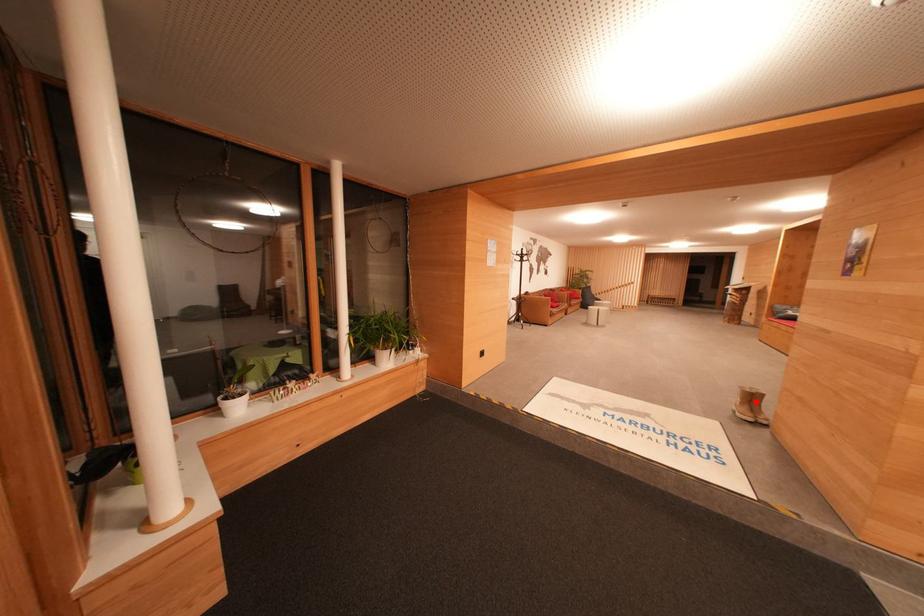
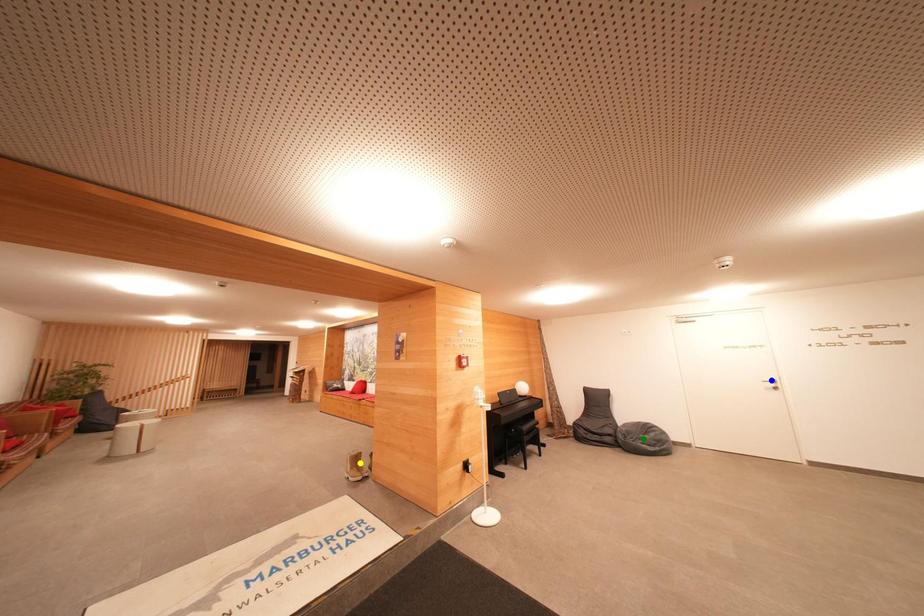
Question: I am providing you with two images of the same scene from different viewpoints. A red point is marked on the first image. You are given multiple points on the second image. In image 2, which mark is for the same physical point as the one in image 1?

Choices:
 (A) blue point
 (B) yellow point
 (C) green point

Answer: (B)